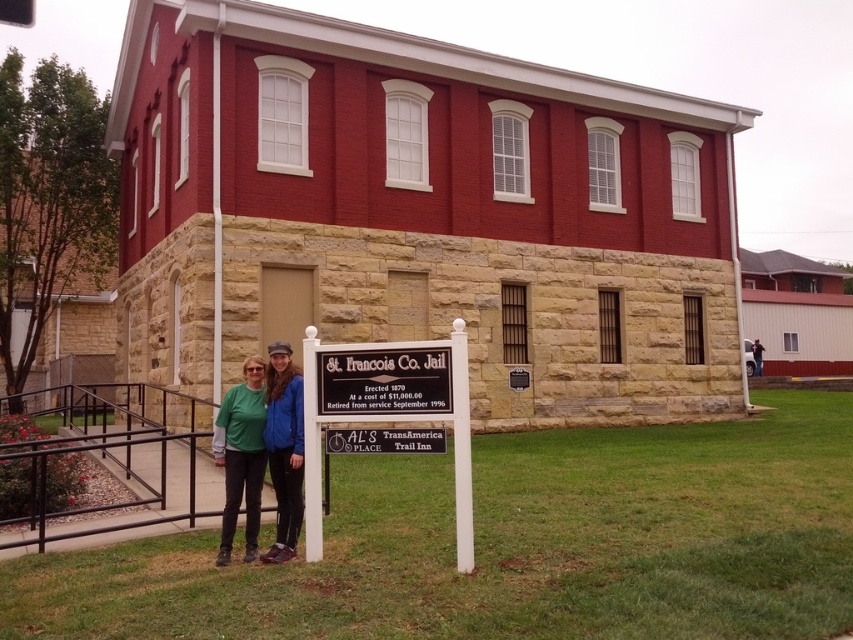
Who is shorter, green fabric at center or dark blue jeans at center?

dark blue jeans at center

Image resolution: width=853 pixels, height=640 pixels. Identify the location of green fabric at center. (259, 449).

Does matte blue jacket at center have a greater width compared to dark blue jeans at center?

No.

Is matte blue jacket at center shorter than dark blue jeans at center?

In fact, matte blue jacket at center may be taller than dark blue jeans at center.

What do you see at coordinates (283, 449) in the screenshot?
I see `matte blue jacket at center` at bounding box center [283, 449].

Where is `matte blue jacket at center`? The height and width of the screenshot is (640, 853). matte blue jacket at center is located at coordinates (283, 449).

Is black metal sign at center above matte blue jacket at center?

Yes.

Identify the location of black metal sign at center. Image resolution: width=853 pixels, height=640 pixels. (387, 410).

At what (x,y) coordinates should I click in order to perform the action: click on black metal sign at center. Please return your answer as a coordinate pair (x, y). Looking at the image, I should click on (387, 410).